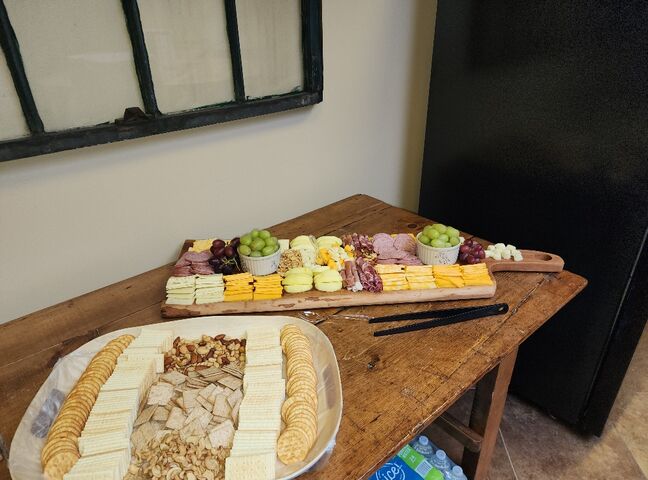
Locate an element on the screen. platter is located at coordinates (321, 347).